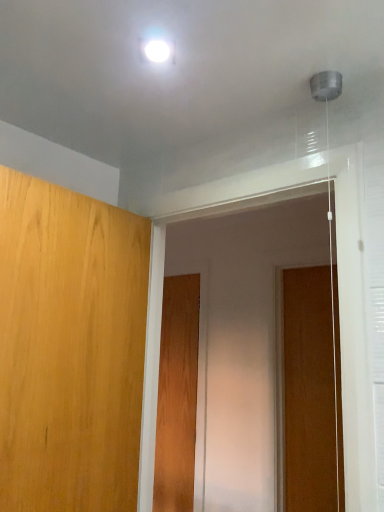
Question: Is wooden door at right, the 1th door from the right, to the right of wooden door at center, positioned as the 3th door in front-to-back order, from the viewer's perspective?

Choices:
 (A) no
 (B) yes

Answer: (B)

Question: Does wooden door at right, acting as the 2th door starting from the back, have a larger size compared to wooden door at center, placed as the 2th door when sorted from right to left?

Choices:
 (A) yes
 (B) no

Answer: (B)

Question: From the image's perspective, does wooden door at right, which appears as the third door when viewed from the left, appear higher than wooden door at center, which is the 2th door in left-to-right order?

Choices:
 (A) yes
 (B) no

Answer: (A)

Question: Is wooden door at right, the second door in the front-to-back sequence, positioned with its back to wooden door at center, which is the first door in back-to-front order?

Choices:
 (A) yes
 (B) no

Answer: (B)

Question: Can you confirm if wooden door at right, acting as the 2th door starting from the back, is wider than wooden door at center, positioned as the 3th door in front-to-back order?

Choices:
 (A) yes
 (B) no

Answer: (B)

Question: From a real-world perspective, is transparent plastic screen door at center positioned above or below wooden door at center, placed as the 2th door when sorted from right to left?

Choices:
 (A) below
 (B) above

Answer: (B)

Question: Considering the positions of point (228, 496) and point (177, 351), is point (228, 496) closer or farther from the camera than point (177, 351)?

Choices:
 (A) closer
 (B) farther

Answer: (A)

Question: From their relative heights in the image, would you say transparent plastic screen door at center is taller or shorter than wooden door at center, which is the 2th door in left-to-right order?

Choices:
 (A) short
 (B) tall

Answer: (A)

Question: Looking at the image, does transparent plastic screen door at center seem bigger or smaller compared to wooden door at center, which is the first door in back-to-front order?

Choices:
 (A) small
 (B) big

Answer: (B)

Question: Considering their positions, is wooden door at center, positioned as the 3th door in front-to-back order, located in front of or behind light brown wood door at left, the 3th door positioned from the right?

Choices:
 (A) behind
 (B) front

Answer: (A)

Question: Looking at the image, does wooden door at center, positioned as the 3th door in front-to-back order, seem bigger or smaller compared to light brown wood door at left, the 3th door positioned from the right?

Choices:
 (A) small
 (B) big

Answer: (A)

Question: Would you say wooden door at center, positioned as the 3th door in front-to-back order, is to the left or to the right of light brown wood door at left, marked as the first door in a front-to-back arrangement, in the picture?

Choices:
 (A) right
 (B) left

Answer: (A)

Question: Considering the positions of wooden door at center, positioned as the 3th door in front-to-back order, and light brown wood door at left, the 3th door positioned from the right, in the image, is wooden door at center, positioned as the 3th door in front-to-back order, taller or shorter than light brown wood door at left, the 3th door positioned from the right,?

Choices:
 (A) tall
 (B) short

Answer: (A)

Question: Is light brown wood door at left, the 3th door positioned from the right, situated inside wooden door at right, the second door in the front-to-back sequence, or outside?

Choices:
 (A) outside
 (B) inside

Answer: (A)

Question: In terms of size, does light brown wood door at left, the 3th door positioned from the right, appear bigger or smaller than wooden door at right, which appears as the third door when viewed from the left?

Choices:
 (A) small
 (B) big

Answer: (B)